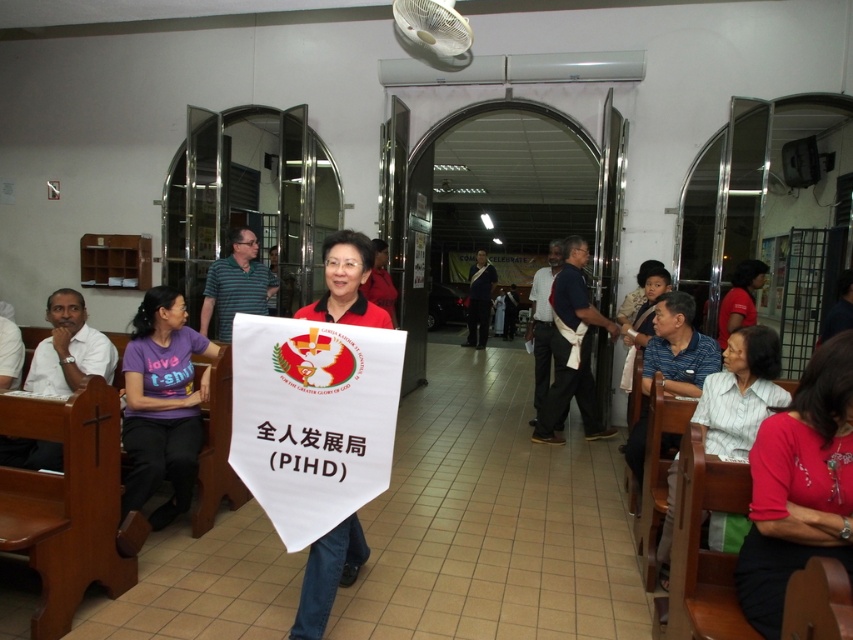
Question: From the image, what is the correct spatial relationship of matte red blouse at lower right in relation to white striped shirt at lower right?

Choices:
 (A) below
 (B) above

Answer: (B)

Question: Which of the following is the farthest from the observer?

Choices:
 (A) (840, 512)
 (B) (746, 330)
 (C) (746, 307)

Answer: (C)

Question: Which of the following is the closest to the observer?

Choices:
 (A) purple t-shirt at left
 (B) white striped shirt at lower right
 (C) matte red shirt at right
 (D) red matte banner at center

Answer: (D)

Question: Can you confirm if white striped shirt at lower right is positioned above matte red shirt at right?

Choices:
 (A) yes
 (B) no

Answer: (B)

Question: Which object is positioned closest to the white striped shirt at lower right?

Choices:
 (A) purple t-shirt at left
 (B) red matte banner at center
 (C) matte red shirt at right
 (D) matte red blouse at lower right

Answer: (D)

Question: Can you confirm if matte red blouse at lower right is positioned to the right of purple t-shirt at left?

Choices:
 (A) no
 (B) yes

Answer: (B)